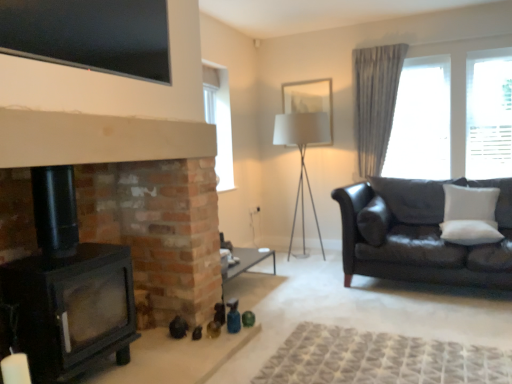
Measure the distance between point (x=470, y=222) and camera.

The distance of point (x=470, y=222) from camera is 3.42 meters.

Measure the distance between point (300, 88) and camera.

4.88 meters.

The height and width of the screenshot is (384, 512). Describe the element at coordinates (302, 155) in the screenshot. I see `white fabric lampshade at center` at that location.

You are a GUI agent. You are given a task and a screenshot of the screen. Output one action in this format:
    pyautogui.click(x=<x>, y=<y>)
    Task: Click on the sheer fabric curtain at right
    The height and width of the screenshot is (384, 512).
    Given the screenshot: What is the action you would take?
    pyautogui.click(x=459, y=85)

Identify the location of white soft cushion at right, the 1th pillow viewed from the front. (470, 232).

Considering the relative sizes of white soft cushion at right, the 1th pillow viewed from the front, and gray fabric curtain at upper right in the image provided, is white soft cushion at right, the 1th pillow viewed from the front, thinner than gray fabric curtain at upper right?

No.

From a real-world perspective, between white soft cushion at right, the 1th pillow viewed from the front, and gray fabric curtain at upper right, who is vertically lower?

In real-world perspective, white soft cushion at right, the 1th pillow viewed from the front, is lower.

From the image's perspective, is white soft cushion at right, placed as the 2th pillow when sorted from back to front, positioned above or below gray fabric curtain at upper right?

Clearly, from the image's perspective, white soft cushion at right, placed as the 2th pillow when sorted from back to front, is below gray fabric curtain at upper right.

Can you confirm if white soft cushion at right, the 1th pillow viewed from the front, is taller than gray fabric curtain at upper right?

No.

Based on the photo, in terms of height, does white soft cushion at right, the 1th pillow viewed from the front, look taller or shorter compared to black glass tv at upper center?

Considering their sizes, white soft cushion at right, the 1th pillow viewed from the front, has less height than black glass tv at upper center.

From a real-world perspective, is white soft cushion at right, placed as the 2th pillow when sorted from back to front, below black glass tv at upper center?

Indeed, from a real-world perspective, white soft cushion at right, placed as the 2th pillow when sorted from back to front, is positioned beneath black glass tv at upper center.

Is white soft cushion at right, placed as the 2th pillow when sorted from back to front, facing towards black glass tv at upper center?

No.

Is point (453, 229) less distant than point (30, 33)?

No, (453, 229) is behind (30, 33).

Is white soft cushion at right, the 1th pillow in the back-to-front sequence, far from white fabric picture frame at upper center?

Yes.

Which object is positioned more to the right, white soft cushion at right, the 1th pillow in the back-to-front sequence, or white fabric picture frame at upper center?

From the viewer's perspective, white soft cushion at right, the 1th pillow in the back-to-front sequence, appears more on the right side.

Can you confirm if white soft cushion at right, placed as the 2th pillow when sorted from front to back, is smaller than white fabric picture frame at upper center?

No.

Is black matte fireplace at lower left not inside white soft cushion at right, placed as the 2th pillow when sorted from back to front?

Yes, black matte fireplace at lower left is located beyond the bounds of white soft cushion at right, placed as the 2th pillow when sorted from back to front.

From the image's perspective, is black matte fireplace at lower left on top of white soft cushion at right, placed as the 2th pillow when sorted from back to front?

Actually, black matte fireplace at lower left appears below white soft cushion at right, placed as the 2th pillow when sorted from back to front, in the image.

Is black matte fireplace at lower left in contact with white soft cushion at right, placed as the 2th pillow when sorted from back to front?

No.

What's the angular difference between sheer fabric curtain at right and white fabric picture frame at upper center's facing directions?

The facing directions of sheer fabric curtain at right and white fabric picture frame at upper center are 0.000665 degrees apart.

This screenshot has height=384, width=512. I want to click on window that appears below the white fabric picture frame at upper center (from a real-world perspective), so click(459, 85).

Measure the distance from sheer fabric curtain at right to white fabric picture frame at upper center.

3.89 feet.

Looking at the image, does sheer fabric curtain at right seem bigger or smaller compared to white fabric picture frame at upper center?

sheer fabric curtain at right is bigger than white fabric picture frame at upper center.

Is sheer fabric curtain at right oriented away from black glass tv at upper center?

No, sheer fabric curtain at right is not facing away from black glass tv at upper center.

Can you confirm if sheer fabric curtain at right is thinner than black glass tv at upper center?

No.

From a real-world perspective, is sheer fabric curtain at right above or below black glass tv at upper center?

In terms of real-world spatial position, sheer fabric curtain at right is below black glass tv at upper center.

Looking at this image, are white soft cushion at right, the 1th pillow in the back-to-front sequence, and black matte fireplace at lower left far apart?

Yes.

Considering the points (493, 215) and (141, 213), which point is behind, point (493, 215) or point (141, 213)?

The point (493, 215) is farther from the camera.

Is white soft cushion at right, the 1th pillow in the back-to-front sequence, aimed at black matte fireplace at lower left?

No, white soft cushion at right, the 1th pillow in the back-to-front sequence, is not facing towards black matte fireplace at lower left.

Is white soft cushion at right, the 1th pillow in the back-to-front sequence, outside of black matte fireplace at lower left?

That's correct, white soft cushion at right, the 1th pillow in the back-to-front sequence, is outside of black matte fireplace at lower left.

From the gray fabric curtain at upper right, count 2nd pillows forward and point to it. Please provide its 2D coordinates.

[(470, 232)]

Where is `window screen on the left of white soft cushion at right, placed as the 2th pillow when sorted from back to front`? Image resolution: width=512 pixels, height=384 pixels. window screen on the left of white soft cushion at right, placed as the 2th pillow when sorted from back to front is located at coordinates (90, 35).

Which object lies nearer to the anchor point sheer fabric curtain at right, white fabric picture frame at upper center or white soft cushion at right, placed as the 2th pillow when sorted from front to back?

white soft cushion at right, placed as the 2th pillow when sorted from front to back, lies closer to sheer fabric curtain at right than the other object.

Based on their spatial positions, is white soft cushion at right, placed as the 2th pillow when sorted from front to back, or black matte fireplace at lower left closer to white fabric lampshade at center?

white soft cushion at right, placed as the 2th pillow when sorted from front to back, is closer to white fabric lampshade at center.

Considering their positions, is sheer fabric curtain at right positioned further to white soft cushion at right, the 1th pillow viewed from the front, than white soft cushion at right, placed as the 2th pillow when sorted from front to back?

The object further to white soft cushion at right, the 1th pillow viewed from the front, is sheer fabric curtain at right.

When comparing their distances from gray fabric curtain at upper right, does black matte fireplace at lower left or black glass tv at upper center seem further?

black glass tv at upper center is positioned further to the anchor gray fabric curtain at upper right.

Which object lies nearer to the anchor point sheer fabric curtain at right, white soft cushion at right, placed as the 2th pillow when sorted from front to back, or white fabric lampshade at center?

white soft cushion at right, placed as the 2th pillow when sorted from front to back, is closer to sheer fabric curtain at right.

Based on the photo, looking at the image, which one is located further to black matte fireplace at lower left, white fabric lampshade at center or sheer fabric curtain at right?

Based on the image, sheer fabric curtain at right appears to be further to black matte fireplace at lower left.

Estimate the real-world distances between objects in this image. Which object is closer to black glass tv at upper center, white soft cushion at right, the 1th pillow in the back-to-front sequence, or leather couch at right?

leather couch at right is closer to black glass tv at upper center.

Estimate the real-world distances between objects in this image. Which object is further from white soft cushion at right, the 1th pillow viewed from the front, black matte fireplace at lower left or white fabric lampshade at center?

black matte fireplace at lower left lies further to white soft cushion at right, the 1th pillow viewed from the front, than the other object.

You are a GUI agent. You are given a task and a screenshot of the screen. Output one action in this format:
    pyautogui.click(x=<x>, y=<y>)
    Task: Click on the curtain between black matte fireplace at lower left and white fabric picture frame at upper center in the front-back direction
    Image resolution: width=512 pixels, height=384 pixels.
    Given the screenshot: What is the action you would take?
    pyautogui.click(x=375, y=102)

This screenshot has height=384, width=512. In order to click on curtain situated between white fabric picture frame at upper center and sheer fabric curtain at right from left to right in this screenshot , I will do `click(375, 102)`.

Where is `studio couch positioned between black matte fireplace at lower left and white fabric picture frame at upper center from near to far`? The width and height of the screenshot is (512, 384). studio couch positioned between black matte fireplace at lower left and white fabric picture frame at upper center from near to far is located at coordinates (419, 234).

Image resolution: width=512 pixels, height=384 pixels. Find the location of `studio couch between black glass tv at upper center and white fabric picture frame at upper center in the front-back direction`. studio couch between black glass tv at upper center and white fabric picture frame at upper center in the front-back direction is located at coordinates (419, 234).